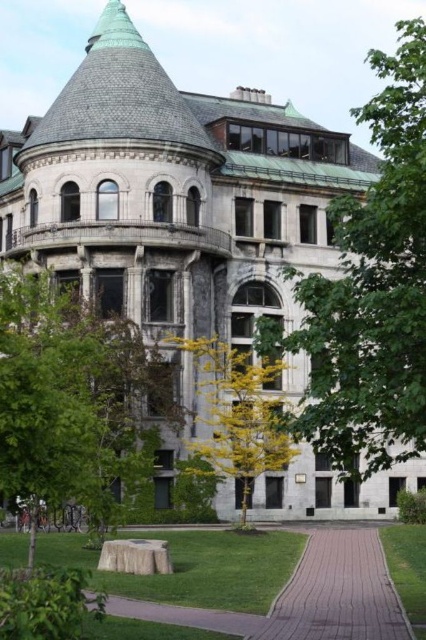
You are planning to install a bench between the green leafy tree at upper center and the green leafy tree at lower left. The bench requires at least 10 meters of space between the two trees to be placed comfortably. Based on the scene, can you determine if there is enough space for the bench?

The green leafy tree at upper center and green leafy tree at lower left are 12.98 meters apart from each other. Since the required space is at least 10 meters, there is enough space to place the bench comfortably between them.

You are standing in front of the historic building and want to take a photo that includes both the point at coordinates point (x=377, y=460) and point (x=103, y=433). Since you want to ensure both points are in focus, which point should you focus on to achieve this?

You should focus on point (x=377, y=460) because it is closer to the camera than point (x=103, y=433). Focusing on the closer point will ensure both are in focus due to the depth of field extending beyond it to the farther point.